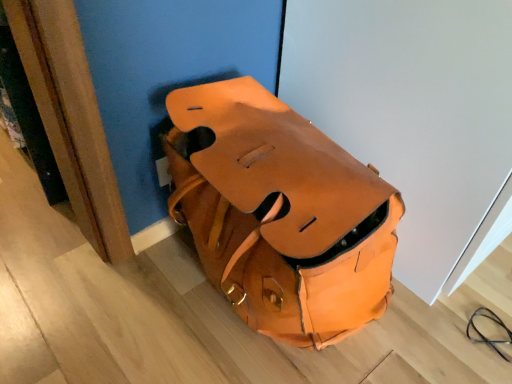
At what (x,y) coordinates should I click in order to perform the action: click on vacant area situated to the left side of leather bag at center. Please return your answer as a coordinate pair (x, y). The height and width of the screenshot is (384, 512). Looking at the image, I should click on (104, 311).